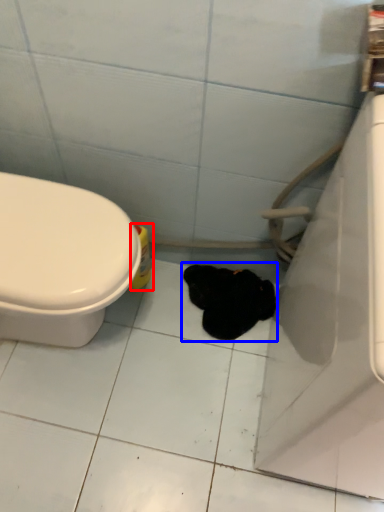
Question: Which of the following is the closest to the observer, cleaning product (highlighted by a red box) or animal (highlighted by a blue box)?

Choices:
 (A) cleaning product
 (B) animal

Answer: (A)